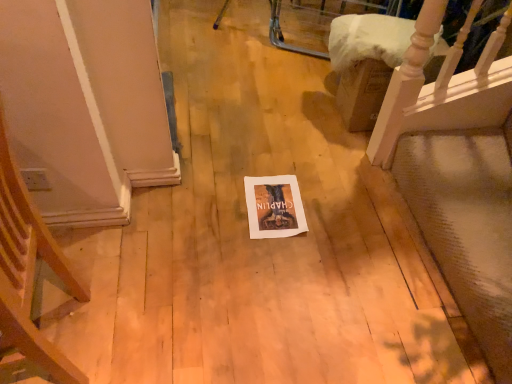
Question: Is white paper at center outside wooden staircase at upper right?

Choices:
 (A) yes
 (B) no

Answer: (A)

Question: Can you confirm if white paper at center is taller than wooden staircase at upper right?

Choices:
 (A) no
 (B) yes

Answer: (A)

Question: From the image's perspective, is white paper at center over wooden staircase at upper right?

Choices:
 (A) yes
 (B) no

Answer: (B)

Question: Is white paper at center further to the viewer compared to wooden staircase at upper right?

Choices:
 (A) yes
 (B) no

Answer: (B)

Question: Is white paper at center in front of wooden staircase at upper right?

Choices:
 (A) yes
 (B) no

Answer: (A)

Question: From the image's perspective, is white paper at center under wooden staircase at upper right?

Choices:
 (A) yes
 (B) no

Answer: (A)

Question: From the image's perspective, does wooden staircase at upper right appear lower than wooden armchair at left?

Choices:
 (A) yes
 (B) no

Answer: (B)

Question: Is wooden staircase at upper right outside of wooden armchair at left?

Choices:
 (A) yes
 (B) no

Answer: (A)

Question: Is wooden armchair at left inside wooden staircase at upper right?

Choices:
 (A) no
 (B) yes

Answer: (A)

Question: Is wooden staircase at upper right facing away from wooden armchair at left?

Choices:
 (A) yes
 (B) no

Answer: (B)

Question: Is wooden staircase at upper right positioned before wooden armchair at left?

Choices:
 (A) yes
 (B) no

Answer: (B)

Question: Does wooden staircase at upper right have a greater height compared to wooden armchair at left?

Choices:
 (A) yes
 (B) no

Answer: (B)

Question: Is wooden armchair at left in front of white paper at center?

Choices:
 (A) no
 (B) yes

Answer: (B)